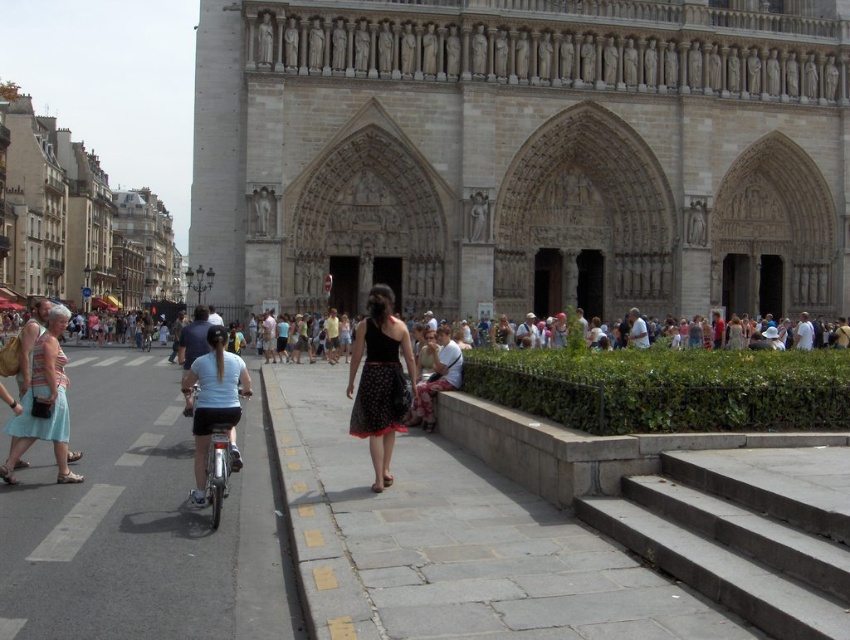
Consider the image. You are standing at the point marked by the coordinates point (43, 401) in the image. Looking towards the cathedral, what color is the dress of the person closest to you?

The point (43, 401) indicates light blue cotton dress at left, so the closest person to you is wearing a light blue cotton dress.